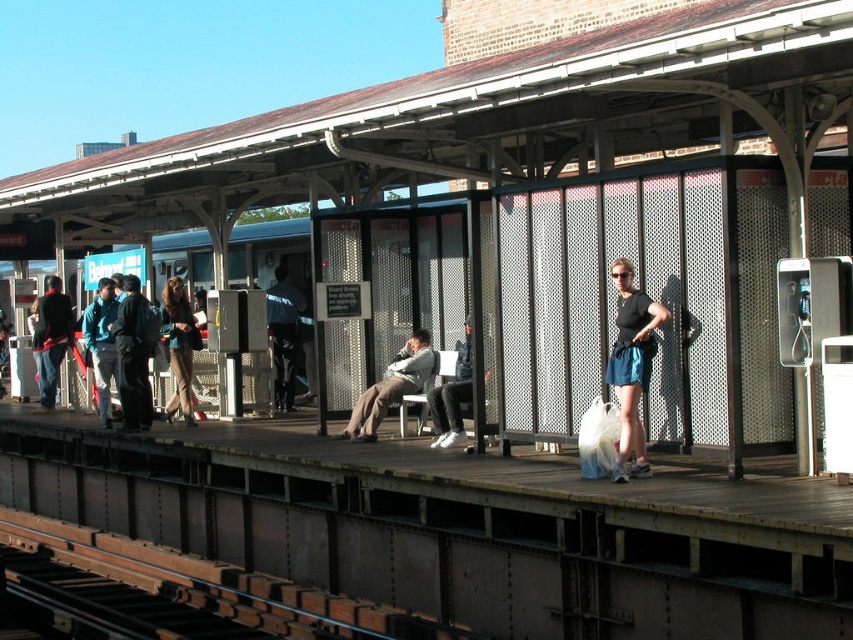
Does point (167, 324) come behind point (466, 317)?

Yes, it is behind point (466, 317).

Which is in front, point (199, 346) or point (469, 385)?

Point (469, 385)

Which is behind, point (181, 340) or point (456, 358)?

Positioned behind is point (181, 340).

You are a GUI agent. You are given a task and a screenshot of the screen. Output one action in this format:
    pyautogui.click(x=<x>, y=<y>)
    Task: Click on the teal fabric jacket at center
    
    Given the screenshot: What is the action you would take?
    pyautogui.click(x=178, y=346)

Find the location of a particular element. Image resolution: width=853 pixels, height=640 pixels. light brown leather jacket at center is located at coordinates (393, 387).

Can you confirm if dark blue jeans at center is thinner than light gray fabric jacket at center?

In fact, dark blue jeans at center might be wider than light gray fabric jacket at center.

Is dark blue jeans at center wider than light gray fabric jacket at center?

Indeed, dark blue jeans at center has a greater width compared to light gray fabric jacket at center.

Measure the distance between dark blue jeans at center and camera.

A distance of 53.16 feet exists between dark blue jeans at center and camera.

Locate an element on the screen. Image resolution: width=853 pixels, height=640 pixels. dark blue jeans at center is located at coordinates (283, 336).